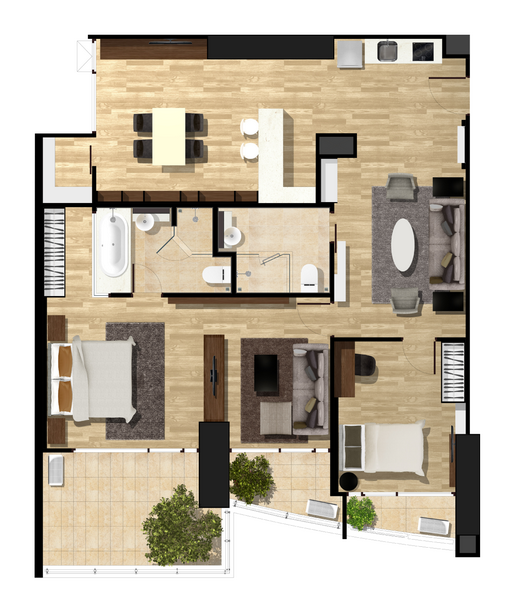
Where is `soft chair`? The width and height of the screenshot is (515, 596). soft chair is located at coordinates (404, 193).